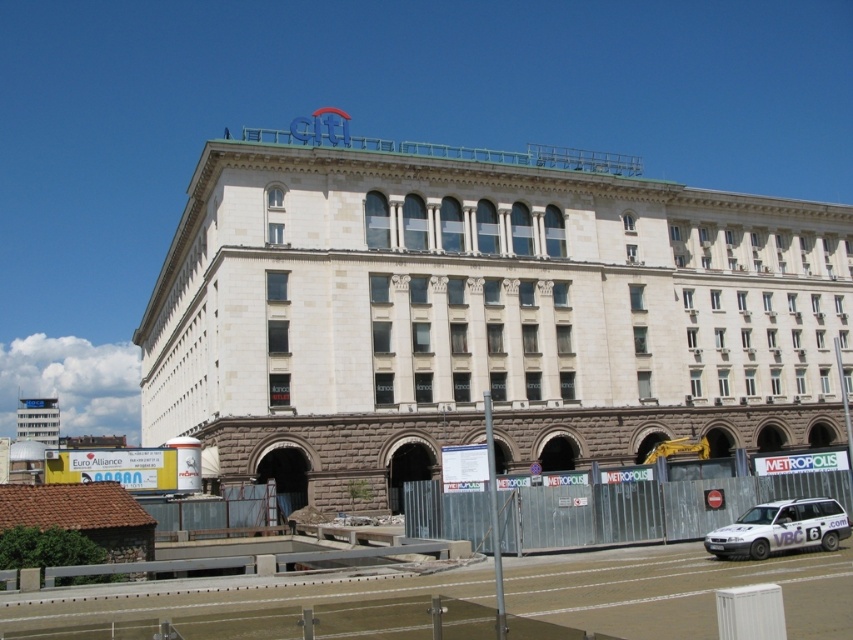
Is white stone building at upper center thinner than white matte van at lower right?

No.

Is point (498, 404) more distant than point (726, 531)?

Yes, point (498, 404) is behind point (726, 531).

Locate an element on the screen. This screenshot has width=853, height=640. white stone building at upper center is located at coordinates (480, 312).